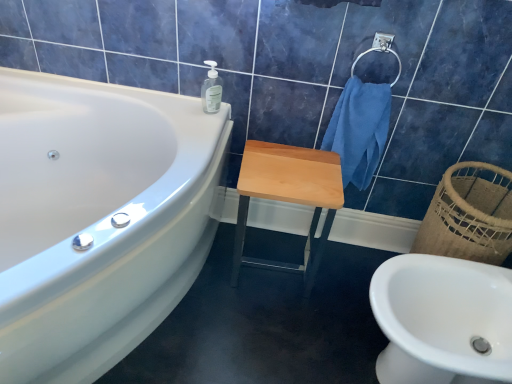
Question: Does transparent plastic soap dispenser at upper center have a greater width compared to light wood/matte stool at center?

Choices:
 (A) no
 (B) yes

Answer: (A)

Question: Could you tell me if transparent plastic soap dispenser at upper center is turned towards light wood/matte stool at center?

Choices:
 (A) no
 (B) yes

Answer: (A)

Question: Can you confirm if transparent plastic soap dispenser at upper center is smaller than light wood/matte stool at center?

Choices:
 (A) no
 (B) yes

Answer: (B)

Question: Considering the relative sizes of transparent plastic soap dispenser at upper center and light wood/matte stool at center in the image provided, is transparent plastic soap dispenser at upper center taller than light wood/matte stool at center?

Choices:
 (A) yes
 (B) no

Answer: (B)

Question: Does transparent plastic soap dispenser at upper center appear on the right side of light wood/matte stool at center?

Choices:
 (A) no
 (B) yes

Answer: (A)

Question: From the image's perspective, relative to white glossy bathtub at upper left, is light wood/matte stool at center above or below?

Choices:
 (A) below
 (B) above

Answer: (B)

Question: Visually, is light wood/matte stool at center positioned to the left or to the right of white glossy bathtub at upper left?

Choices:
 (A) left
 (B) right

Answer: (B)

Question: In terms of height, does light wood/matte stool at center look taller or shorter compared to white glossy bathtub at upper left?

Choices:
 (A) tall
 (B) short

Answer: (B)

Question: Is point (306, 286) closer or farther from the camera than point (109, 206)?

Choices:
 (A) farther
 (B) closer

Answer: (A)

Question: Based on their positions, is transparent plastic soap dispenser at upper center located to the left or right of white glossy sink at lower right?

Choices:
 (A) left
 (B) right

Answer: (A)

Question: In terms of size, does transparent plastic soap dispenser at upper center appear bigger or smaller than white glossy sink at lower right?

Choices:
 (A) big
 (B) small

Answer: (B)

Question: From the image's perspective, is transparent plastic soap dispenser at upper center above or below white glossy sink at lower right?

Choices:
 (A) below
 (B) above

Answer: (B)

Question: Looking at their shapes, would you say transparent plastic soap dispenser at upper center is wider or thinner than white glossy sink at lower right?

Choices:
 (A) wide
 (B) thin

Answer: (B)

Question: From a real-world perspective, relative to white glossy bathtub at upper left, is satin silver towel bar at upper right vertically above or below?

Choices:
 (A) below
 (B) above

Answer: (B)

Question: From the image's perspective, is satin silver towel bar at upper right located above or below white glossy bathtub at upper left?

Choices:
 (A) above
 (B) below

Answer: (A)